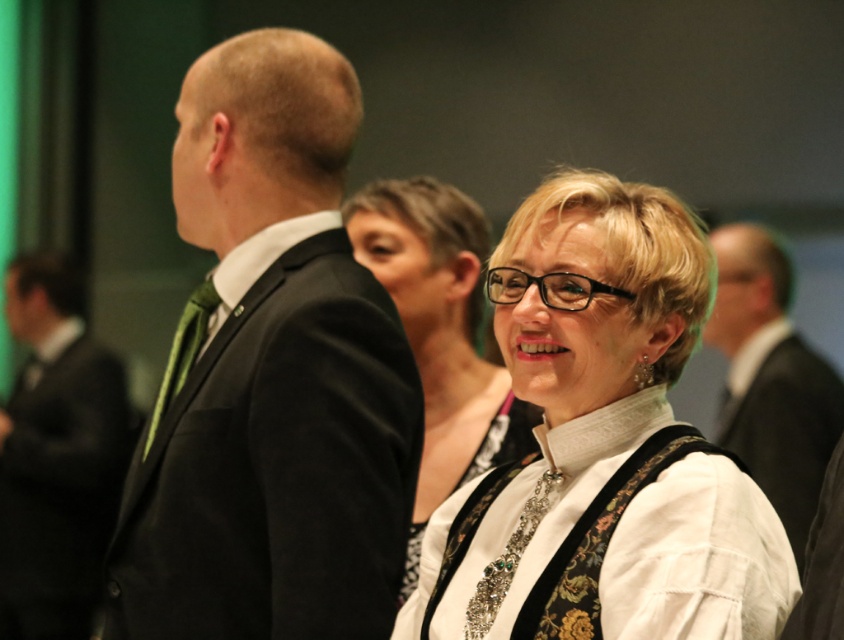
You are at a formal event and notice two white lace garments at the center of the image. Which one is taller, the white lace blouse at center or the white lace dress at center?

The white lace blouse at center is taller than the white lace dress at center according to the description.

Please look at the image and locate the point at coordinates (603, 442). Which object in the scene does this point fall on?

The point at coordinates (603, 442) falls on the white textured blouse at center.